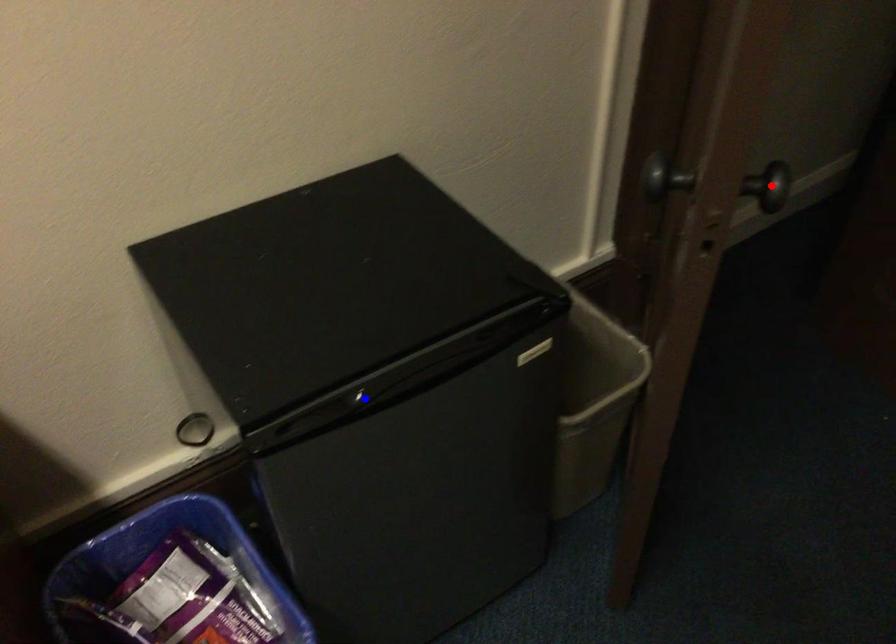
Question: Two points are marked on the image. Which point is closer to the camera?

Choices:
 (A) Blue point is closer.
 (B) Red point is closer.

Answer: (B)